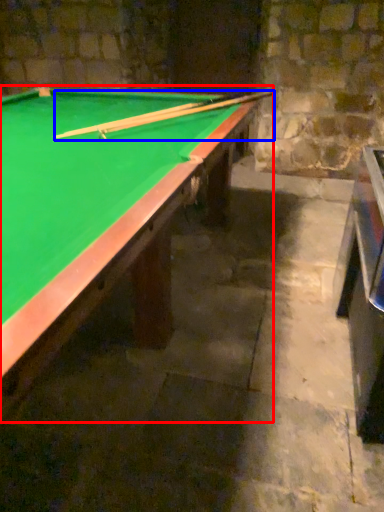
Question: Which object is closer to the camera taking this photo, billiard table (highlighted by a red box) or cue (highlighted by a blue box)?

Choices:
 (A) billiard table
 (B) cue

Answer: (A)